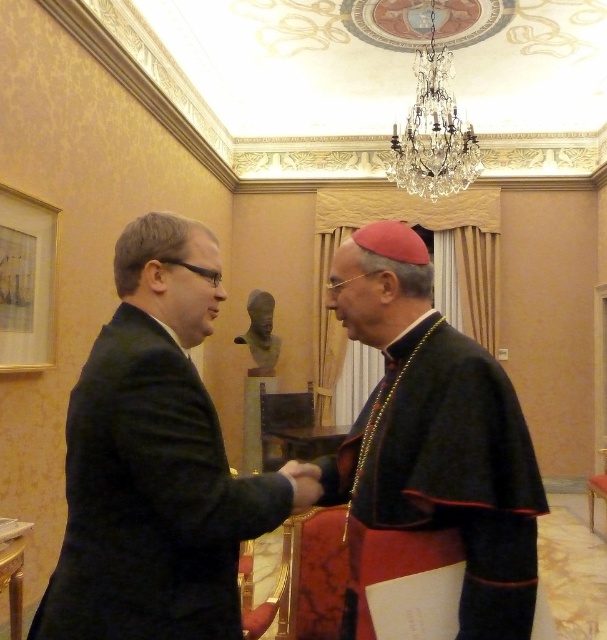
Question: Can you confirm if black velvet robe at center is bigger than velvet black robe at left?

Choices:
 (A) no
 (B) yes

Answer: (B)

Question: Does black velvet robe at center appear on the left side of velvet black robe at left?

Choices:
 (A) no
 (B) yes

Answer: (A)

Question: Which of the following is the closest to the observer?

Choices:
 (A) black velvet robe at center
 (B) velvet black robe at left

Answer: (B)

Question: Is black velvet robe at center wider than velvet black robe at left?

Choices:
 (A) no
 (B) yes

Answer: (A)